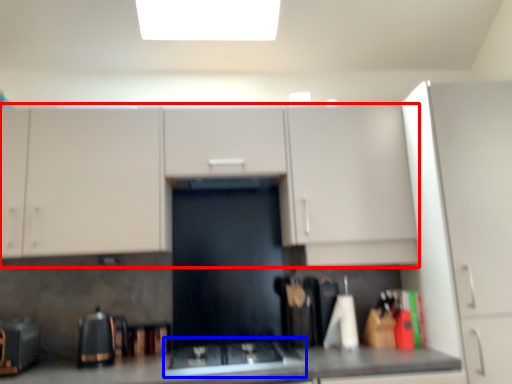
Question: Which object is further to the camera taking this photo, cabinetry (highlighted by a red box) or gas stove (highlighted by a blue box)?

Choices:
 (A) cabinetry
 (B) gas stove

Answer: (A)